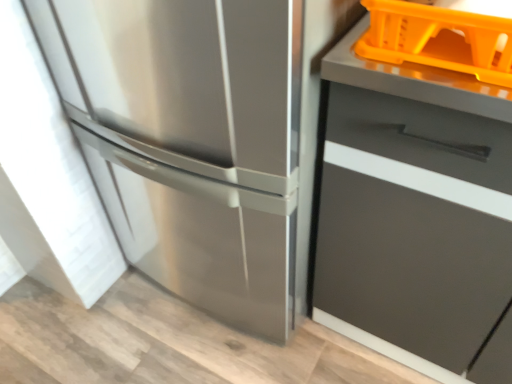
Question: From the image's perspective, would you say stainless steel refrigerator at left is positioned over orange plastic basket at upper right?

Choices:
 (A) no
 (B) yes

Answer: (A)

Question: Is stainless steel refrigerator at left aimed at orange plastic basket at upper right?

Choices:
 (A) yes
 (B) no

Answer: (B)

Question: Is stainless steel refrigerator at left located outside orange plastic basket at upper right?

Choices:
 (A) no
 (B) yes

Answer: (B)

Question: Considering the relative sizes of stainless steel refrigerator at left and orange plastic basket at upper right in the image provided, is stainless steel refrigerator at left thinner than orange plastic basket at upper right?

Choices:
 (A) no
 (B) yes

Answer: (A)

Question: From a real-world perspective, is stainless steel refrigerator at left on orange plastic basket at upper right?

Choices:
 (A) yes
 (B) no

Answer: (B)

Question: Visually, is matte gray drawer at right positioned to the left or to the right of orange plastic basket at upper right?

Choices:
 (A) left
 (B) right

Answer: (B)

Question: From a real-world perspective, is matte gray drawer at right positioned above or below orange plastic basket at upper right?

Choices:
 (A) above
 (B) below

Answer: (B)

Question: Looking at the image, does matte gray drawer at right seem bigger or smaller compared to orange plastic basket at upper right?

Choices:
 (A) big
 (B) small

Answer: (A)

Question: Is matte gray drawer at right inside the boundaries of orange plastic basket at upper right, or outside?

Choices:
 (A) outside
 (B) inside

Answer: (A)

Question: From a real-world perspective, relative to matte gray drawer at right, is stainless steel refrigerator at left vertically above or below?

Choices:
 (A) below
 (B) above

Answer: (B)

Question: In the image, is stainless steel refrigerator at left positioned in front of or behind matte gray drawer at right?

Choices:
 (A) front
 (B) behind

Answer: (B)

Question: Is stainless steel refrigerator at left to the left or to the right of matte gray drawer at right in the image?

Choices:
 (A) left
 (B) right

Answer: (A)

Question: From the image's perspective, is stainless steel refrigerator at left above or below matte gray drawer at right?

Choices:
 (A) below
 (B) above

Answer: (B)

Question: Visually, is orange plastic basket at upper right positioned to the left or to the right of stainless steel refrigerator at left?

Choices:
 (A) right
 (B) left

Answer: (A)

Question: From a real-world perspective, is orange plastic basket at upper right above or below stainless steel refrigerator at left?

Choices:
 (A) below
 (B) above

Answer: (B)